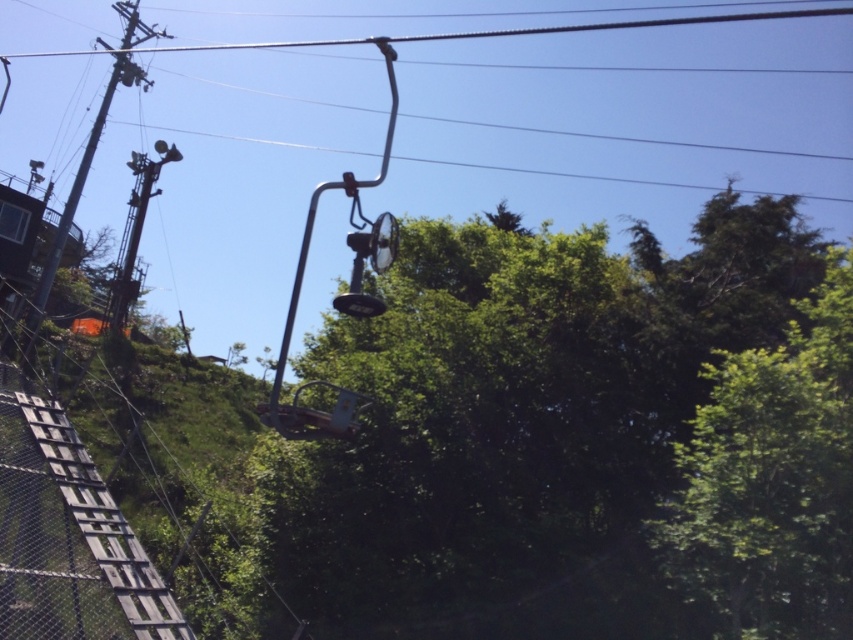
Based on the photo, you are a hiker trying to determine the relative positions of two green leafy trees in the scene. Which tree is positioned higher in the image, the green leafy tree at center or the green leafy tree at upper right?

The green leafy tree at center is positioned higher in the image than the green leafy tree at upper right.

Looking at this image, you are a hiker standing at the base of the slope looking towards the ski lift. You notice a green leafy tree at center and a metallic wire at upper center. Which object is closer to you?

The green leafy tree at center is closer to the viewer than the metallic wire at upper center, so the green leafy tree at center is closer to you.

You are standing at the wooden structure with a chain link fence in the foreground of the ski lift scene. There is a green leafy tree at center located at point [518,424]. If you face the direction of the ski lift cable running horizontally across the frame, which direction should you turn to look towards the green leafy tree at center?

The green leafy tree at center is located at point [518,424], which is directly in front of you when facing the ski lift cable. Therefore, you don not need to turn and can look straight ahead to see it.